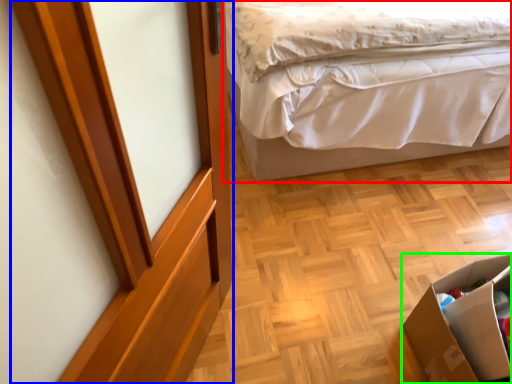
Question: Which object is the closest to the bed (highlighted by a red box)? Choose among these: screen door (highlighted by a blue box) or cardboard box (highlighted by a green box).

Choices:
 (A) screen door
 (B) cardboard box

Answer: (B)